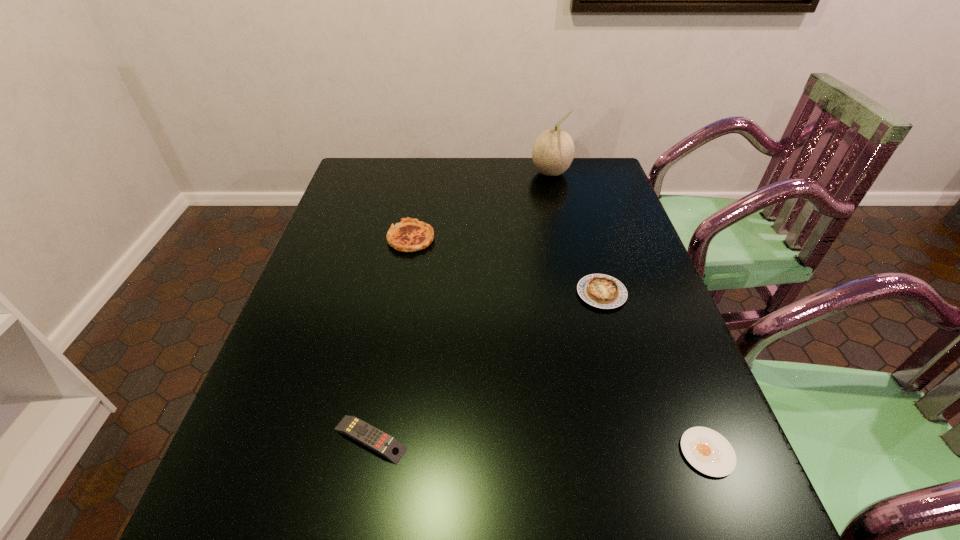
Identify the location of the tallest object. (553, 151).

The image size is (960, 540). Find the location of `the farthest object`. the farthest object is located at coordinates pos(553,151).

Locate an element on the screen. This screenshot has height=540, width=960. the left quiche is located at coordinates (410, 235).

Image resolution: width=960 pixels, height=540 pixels. Find the location of `the taller quiche`. the taller quiche is located at coordinates (410, 235).

Locate an element on the screen. The width and height of the screenshot is (960, 540). the third shortest object is located at coordinates (602, 291).

The image size is (960, 540). I want to click on the right quiche, so (x=602, y=291).

Find the location of `remote control`. remote control is located at coordinates (373, 438).

The image size is (960, 540). What are the coordinates of `egg yolk` in the screenshot? It's located at (709, 452).

Find the location of `the shortest object`. the shortest object is located at coordinates (709, 452).

This screenshot has width=960, height=540. Find the location of `vacant area situated 0.100m on the front of the tallest object`. vacant area situated 0.100m on the front of the tallest object is located at coordinates (558, 201).